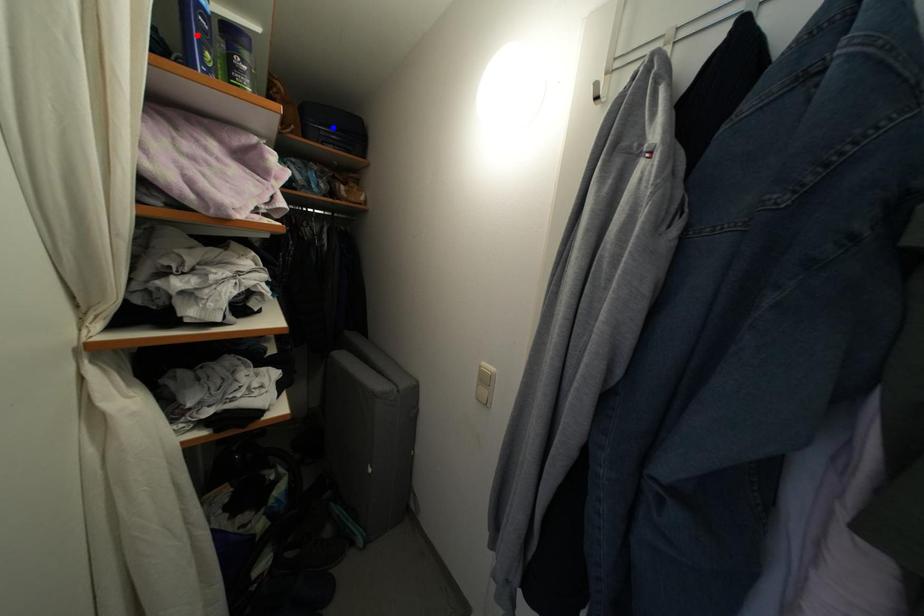
Question: Two points are marked on the image. Which point is closer to the camera?

Choices:
 (A) Blue point is closer.
 (B) Red point is closer.

Answer: (B)